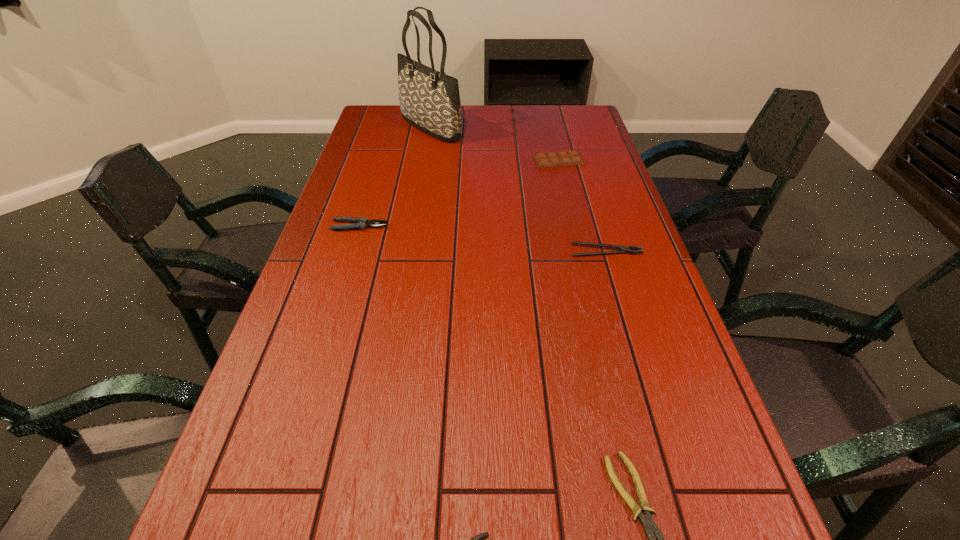
At what (x,y) coordinates should I click in order to perform the action: click on free space between the second farthest object and the tallest pliers. Please return your answer as a coordinate pair (x, y). Image resolution: width=960 pixels, height=540 pixels. Looking at the image, I should click on (459, 193).

Locate an element on the screen. vacant area between the fourth farthest object and the tote bag is located at coordinates (518, 189).

I want to click on vacant point located between the fourth nearest object and the farthest object, so click(x=396, y=177).

Where is `free spot between the third nearest object and the farthest object`? The height and width of the screenshot is (540, 960). free spot between the third nearest object and the farthest object is located at coordinates (518, 189).

Locate which object ranks second in proximity to the tote bag. Please provide its 2D coordinates. Your answer should be formatted as a tuple, i.e. [(x, y)], where the tuple contains the x and y coordinates of a point satisfying the conditions above.

[(359, 223)]

The width and height of the screenshot is (960, 540). Identify the location of the closest object to the tote bag. (564, 158).

Locate an element on the screen. pliers that is the second closest to the second pliers from right to left is located at coordinates (359, 223).

Locate an element on the screen. The image size is (960, 540). pliers that stands as the closest to the rightmost pliers is located at coordinates (478, 539).